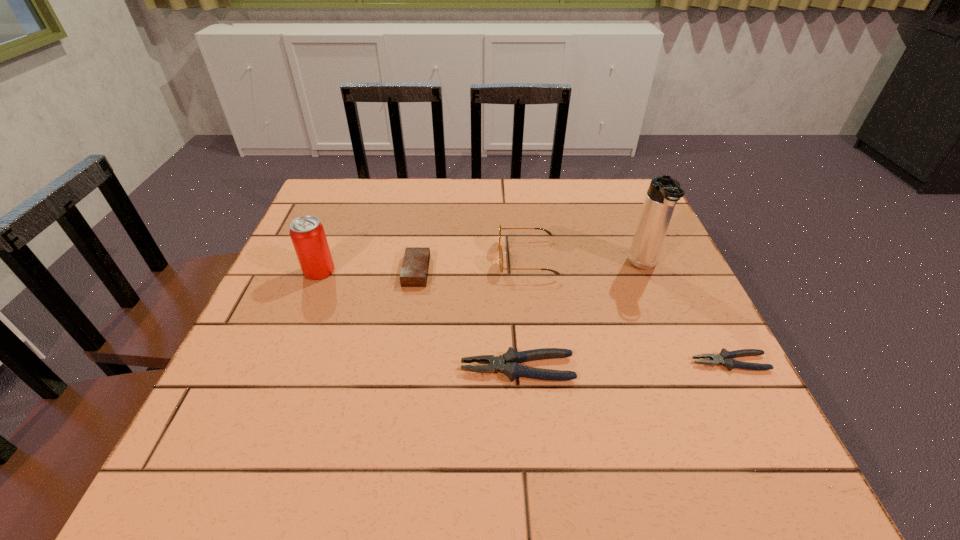
Please point out where to position a new pliers on the left to maintain spacing. Please provide its 2D coordinates. Your answer should be formatted as a tuple, i.e. [(x, y)], where the tuple contains the x and y coordinates of a point satisfying the conditions above.

[(300, 374)]